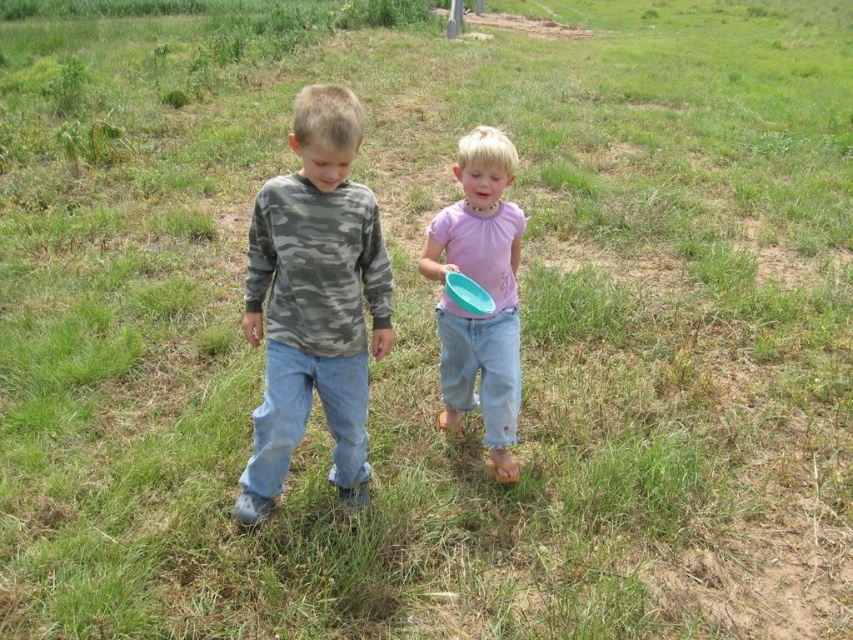
Question: Which point appears closest to the camera in this image?

Choices:
 (A) (334, 452)
 (B) (444, 280)
 (C) (497, 168)

Answer: (C)

Question: Which point is closer to the camera?

Choices:
 (A) (469, 376)
 (B) (341, 499)

Answer: (B)

Question: Which object is the farthest from the pink matte shirt at center?

Choices:
 (A) matte blue frisbee at center
 (B) camo fabric shirt at center

Answer: (B)

Question: Is camo fabric shirt at center positioned in front of pink matte shirt at center?

Choices:
 (A) no
 (B) yes

Answer: (B)

Question: Is pink matte shirt at center below matte blue frisbee at center?

Choices:
 (A) yes
 (B) no

Answer: (A)

Question: Is the position of camo fabric shirt at center more distant than that of pink matte shirt at center?

Choices:
 (A) no
 (B) yes

Answer: (A)